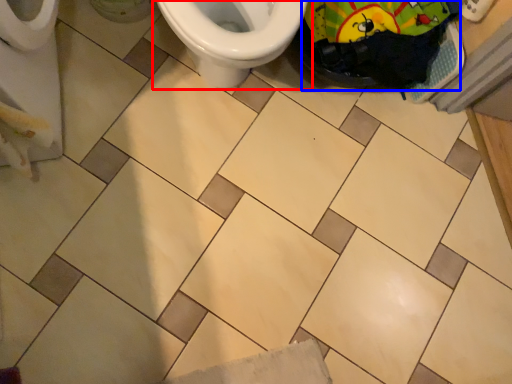
Question: Which point is further to the camera, toilet (highlighted by a red box) or material (highlighted by a blue box)?

Choices:
 (A) toilet
 (B) material

Answer: (B)